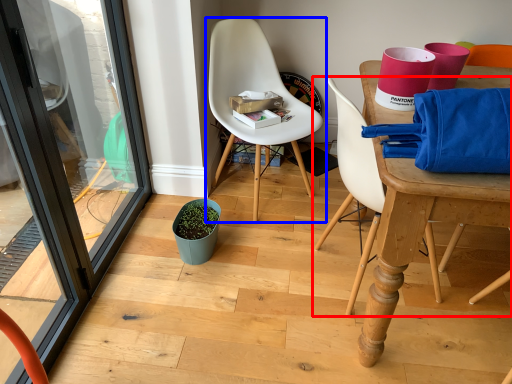
Question: Which object is further to the camera taking this photo, chair (highlighted by a red box) or chair (highlighted by a blue box)?

Choices:
 (A) chair
 (B) chair

Answer: (B)